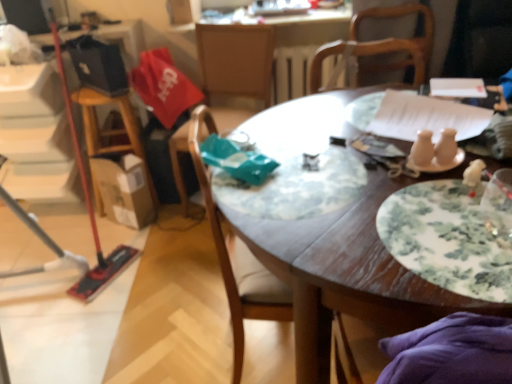
Identify the location of free spot above wooden table at center (from a real-world perspective). Image resolution: width=512 pixels, height=384 pixels. point(362,167).